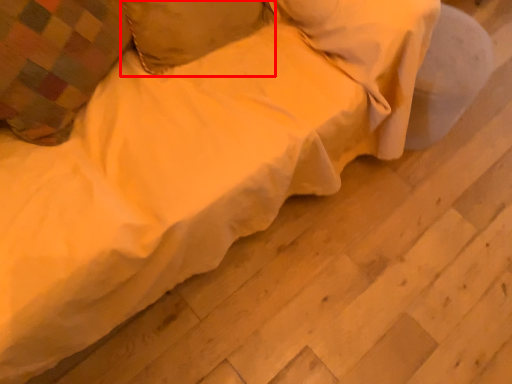
Question: From the image's perspective, what is the correct spatial positioning of pillow (annotated by the red box) in reference to pillow?

Choices:
 (A) below
 (B) above

Answer: (B)